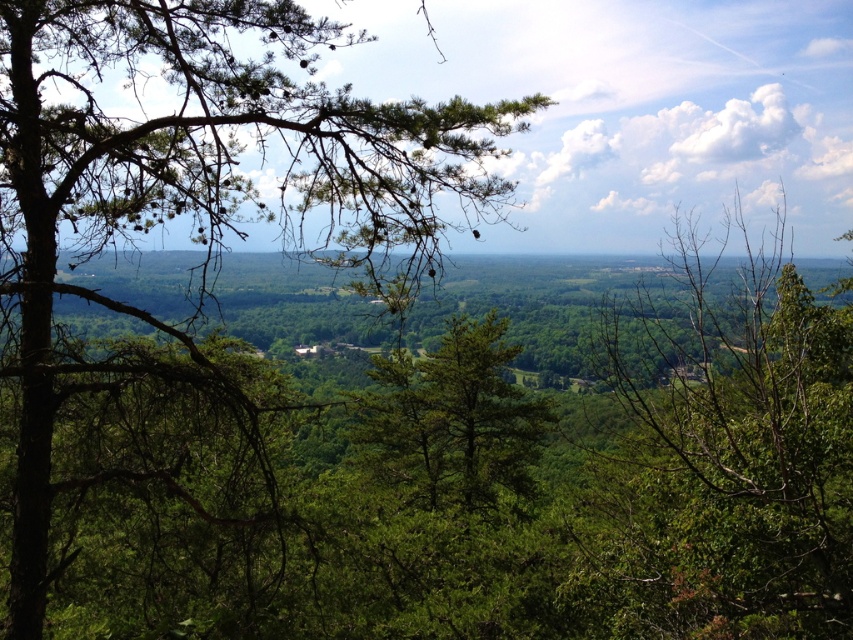
Question: Which point appears closest to the camera in this image?

Choices:
 (A) (67, 132)
 (B) (590, 568)

Answer: (A)

Question: Among these objects, which one is nearest to the camera?

Choices:
 (A) green leafy tree at center
 (B) green matte tree at upper left

Answer: (A)

Question: Is green matte tree at upper left closer to camera compared to green leafy tree at center?

Choices:
 (A) yes
 (B) no

Answer: (B)

Question: Which point is closer to the camera?

Choices:
 (A) green matte tree at upper left
 (B) green leafy tree at center

Answer: (B)

Question: Considering the relative positions of green matte tree at upper left and green leafy tree at center in the image provided, where is green matte tree at upper left located with respect to green leafy tree at center?

Choices:
 (A) left
 (B) right

Answer: (A)

Question: Is green matte tree at upper left bigger than green leafy tree at center?

Choices:
 (A) yes
 (B) no

Answer: (B)